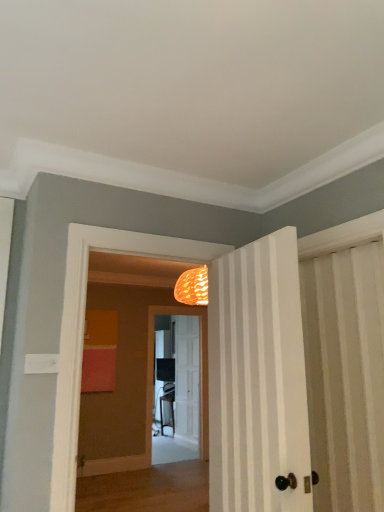
Question: Is white striped door at center, which appears as the first door when viewed from the front, looking in the opposite direction of white wooden door at center, the 1th door positioned from the bottom?

Choices:
 (A) yes
 (B) no

Answer: (B)

Question: Is white striped door at center, the second door viewed from the left, smaller than white wooden door at center, which is the second door from right to left?

Choices:
 (A) no
 (B) yes

Answer: (A)

Question: Does white striped door at center, the 2th door positioned from the bottom, have a greater width compared to white wooden door at center, acting as the first door starting from the back?

Choices:
 (A) no
 (B) yes

Answer: (B)

Question: Is the depth of white striped door at center, the 2th door when ordered from back to front, less than that of white wooden door at center, which is the second door from right to left?

Choices:
 (A) yes
 (B) no

Answer: (A)

Question: From the image's perspective, is white striped door at center, the second door viewed from the left, located above white wooden door at center, marked as the 2th door in a top-to-bottom arrangement?

Choices:
 (A) no
 (B) yes

Answer: (B)

Question: From a real-world perspective, is matte black screen door at center above or below white striped door at center, the 2th door positioned from the bottom?

Choices:
 (A) below
 (B) above

Answer: (A)

Question: Considering the positions of point (147, 437) and point (213, 429), is point (147, 437) closer or farther from the camera than point (213, 429)?

Choices:
 (A) closer
 (B) farther

Answer: (B)

Question: Is matte black screen door at center spatially inside white striped door at center, the 2th door positioned from the bottom, or outside of it?

Choices:
 (A) inside
 (B) outside

Answer: (B)

Question: From their relative heights in the image, would you say matte black screen door at center is taller or shorter than white striped door at center, which appears as the first door when viewed from the front?

Choices:
 (A) short
 (B) tall

Answer: (B)

Question: In the image, is white striped door at center, the 2th door positioned from the bottom, on the left side or the right side of matte black screen door at center?

Choices:
 (A) right
 (B) left

Answer: (A)

Question: Based on their sizes in the image, would you say white striped door at center, which ranks as the first door in top-to-bottom order, is bigger or smaller than matte black screen door at center?

Choices:
 (A) big
 (B) small

Answer: (A)

Question: Considering the positions of white striped door at center, which appears as the first door when viewed from the front, and matte black screen door at center in the image, is white striped door at center, which appears as the first door when viewed from the front, taller or shorter than matte black screen door at center?

Choices:
 (A) short
 (B) tall

Answer: (A)

Question: Is white striped door at center, the 2th door when ordered from back to front, wider or thinner than matte black screen door at center?

Choices:
 (A) wide
 (B) thin

Answer: (A)

Question: Does point (148, 444) appear closer or farther from the camera than point (195, 358)?

Choices:
 (A) closer
 (B) farther

Answer: (A)

Question: Is matte black screen door at center to the left or to the right of white wooden door at center, the 1th door positioned from the bottom, in the image?

Choices:
 (A) left
 (B) right

Answer: (A)